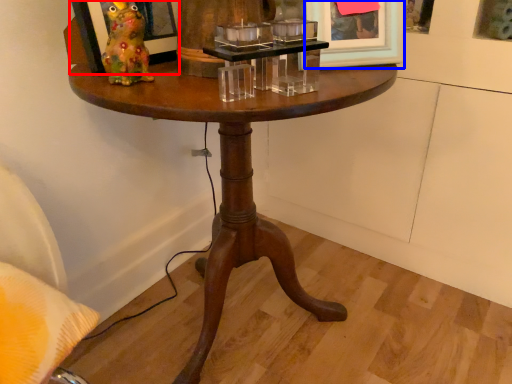
Question: Which object is closer to the camera taking this photo, picture frame (highlighted by a red box) or picture frame (highlighted by a blue box)?

Choices:
 (A) picture frame
 (B) picture frame

Answer: (A)